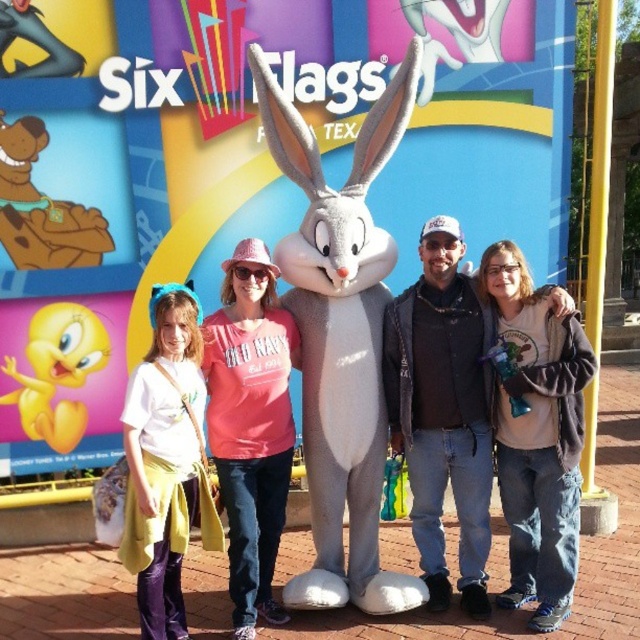
Question: Estimate the real-world distances between objects in this image. Which object is farther from the brown fuzzy jacket at lower right?

Choices:
 (A) yellow fabric headband at left
 (B) white plush rabbit at center
 (C) pink fabric shirt at center

Answer: (A)

Question: Can you confirm if brown fuzzy jacket at lower right is bigger than pink fabric shirt at center?

Choices:
 (A) no
 (B) yes

Answer: (B)

Question: In this image, where is white plush rabbit at center located relative to brown fuzzy jacket at lower right?

Choices:
 (A) below
 (B) above

Answer: (B)

Question: Which point is closer to the camera?

Choices:
 (A) (264, 355)
 (B) (163, 376)
 (C) (570, 515)
 (D) (364, 300)

Answer: (B)

Question: Which object is the farthest from the pink fabric shirt at center?

Choices:
 (A) brown fuzzy jacket at lower right
 (B) white plush rabbit at center

Answer: (A)

Question: In this image, where is white plush rabbit at center located relative to brown fuzzy jacket at lower right?

Choices:
 (A) left
 (B) right

Answer: (A)